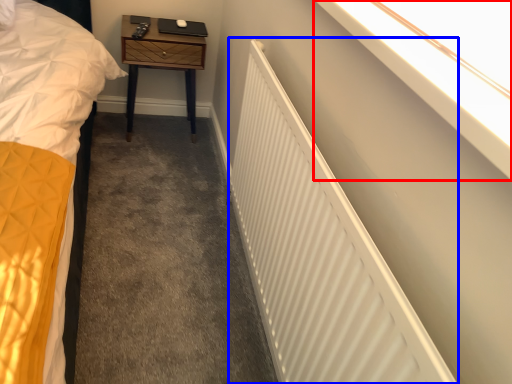
Question: Among these objects, which one is nearest to the camera, window sill (highlighted by a red box) or radiator (highlighted by a blue box)?

Choices:
 (A) window sill
 (B) radiator

Answer: (A)